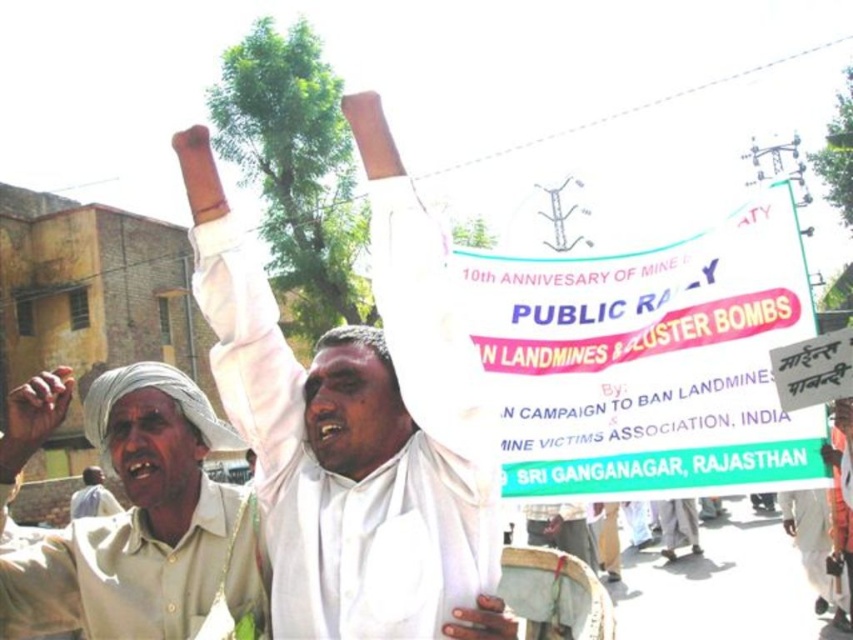
Between point (369, 116) and point (172, 621), which one is positioned behind?

Positioned behind is point (172, 621).

Is white cloth at center wider than beige cotton shirt at upper left?

Correct, the width of white cloth at center exceeds that of beige cotton shirt at upper left.

This screenshot has height=640, width=853. I want to click on white cloth at center, so (355, 422).

Can you confirm if white cloth at center is positioned to the right of light beige fabric turban at lower left?

Correct, you'll find white cloth at center to the right of light beige fabric turban at lower left.

Who is more forward, (363, 141) or (91, 492)?

Point (363, 141) is more forward.

Identify the location of white cloth at center. (355, 422).

Measure the distance between beige cotton shirt at upper left and camera.

They are 104.12 feet apart.

Between beige cotton shirt at upper left and light beige fabric turban at lower left, which one appears on the left side from the viewer's perspective?

Positioned to the left is light beige fabric turban at lower left.

Is point (151, 387) closer to camera compared to point (119, 502)?

That is True.

I want to click on beige cotton shirt at upper left, so click(134, 520).